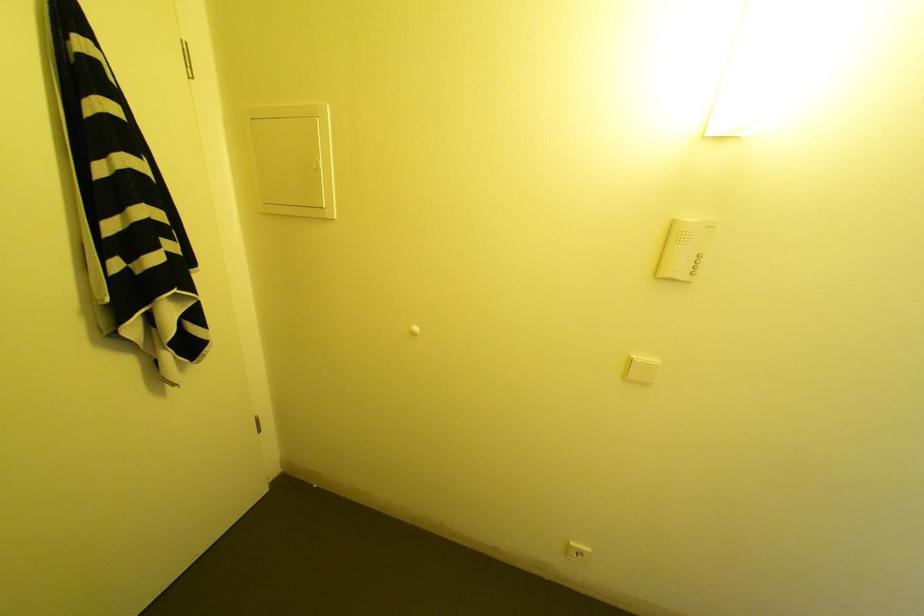
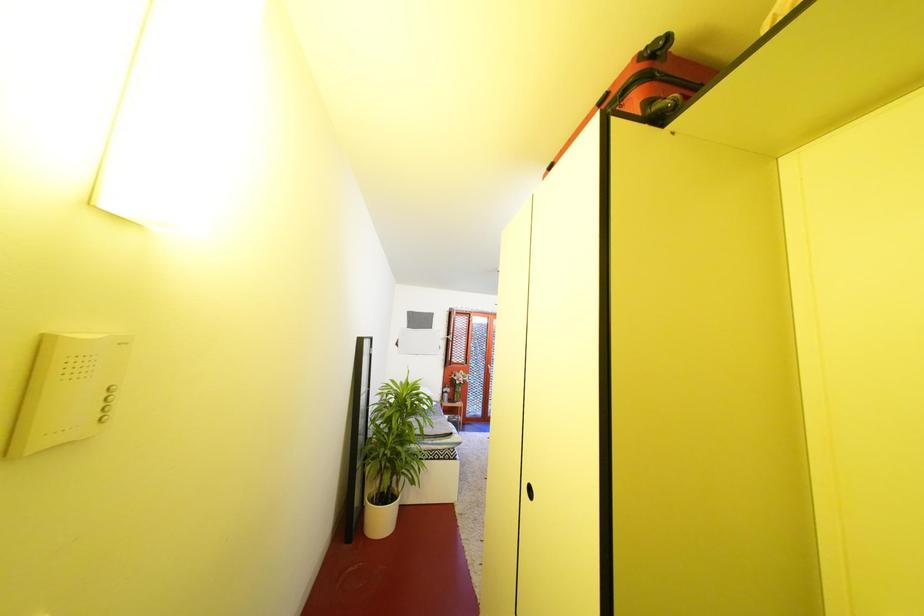
Question: The camera is either moving clockwise (left) or counter-clockwise (right) around the object. The first image is from the beginning of the video and the second image is from the end. Is the camera moving left or right when shooting the video?

Choices:
 (A) Left
 (B) Right

Answer: (A)